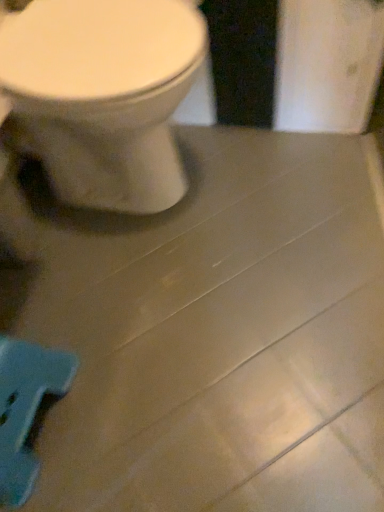
At what (x,y) coordinates should I click in order to perform the action: click on vacant space in white glossy toilet at upper left (from a real-world perspective). Please return your answer as a coordinate pair (x, y). Looking at the image, I should click on (126, 208).